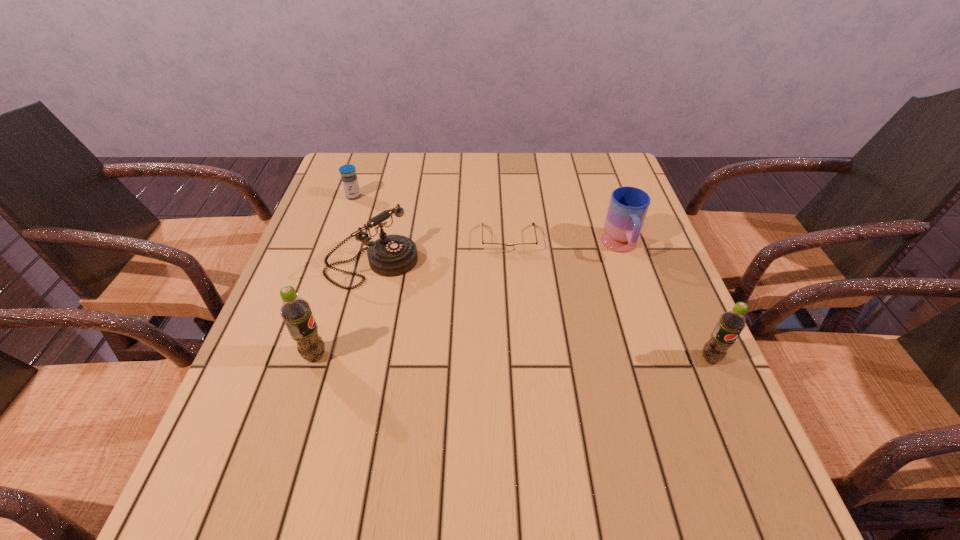
I want to click on free space that satisfies the following two spatial constraints: 1. on the front-facing side of the third object from right to left; 2. on the front label of the taller soda, so click(x=516, y=355).

Locate an element on the screen. This screenshot has width=960, height=540. blank area in the image that satisfies the following two spatial constraints: 1. on the side of the second object from right to left with the handle; 2. on the front label of the tallest object is located at coordinates (658, 355).

Identify the location of free spot that satisfies the following two spatial constraints: 1. on the side of the fifth object from left to right with the handle; 2. on the front label of the left soda. This screenshot has height=540, width=960. (658, 355).